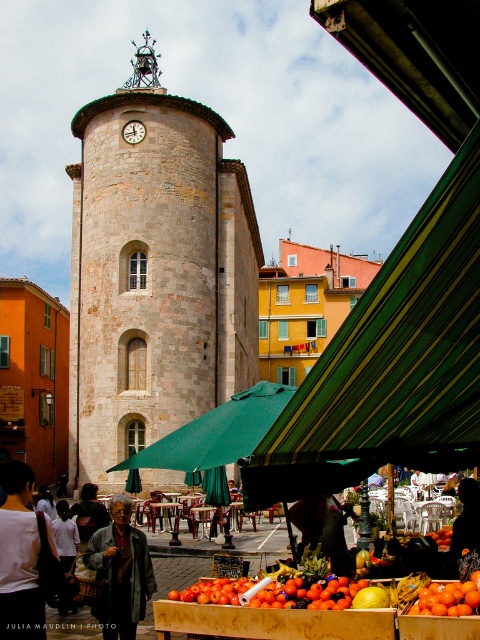
Which is below, white cotton shirt at center or orange matte/orange textured fruit at center?

orange matte/orange textured fruit at center

Does white cotton shirt at center appear under orange matte/orange textured fruit at center?

No.

Is point (1, 561) farther from viewer compared to point (418, 612)?

Yes, it is.

Identify the location of white cotton shirt at center. 19,557.

Between green striped awning at center and matte white clock at center, which one appears on the right side from the viewer's perspective?

Positioned to the right is green striped awning at center.

Who is higher up, green striped awning at center or matte white clock at center?

matte white clock at center is higher up.

Is point (472, 273) farther from viewer compared to point (136, 129)?

No.

You are a GUI agent. You are given a task and a screenshot of the screen. Output one action in this format:
    pyautogui.click(x=<x>, y=<y>)
    Task: Click on the green striped awning at center
    The width and height of the screenshot is (480, 640).
    Given the screenshot: What is the action you would take?
    pyautogui.click(x=392, y=362)

Where is `green striped awning at center`? The image size is (480, 640). green striped awning at center is located at coordinates (392, 362).